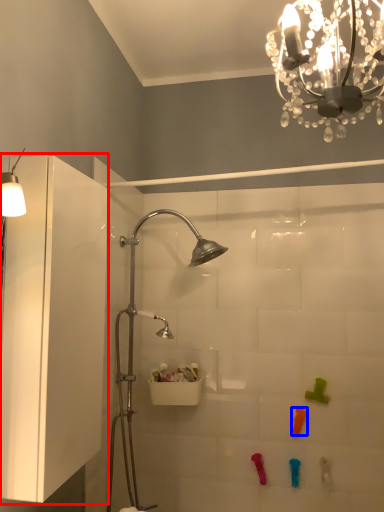
Question: Which object appears closest to the camera in this image, glass door (highlighted by a red box) or toy (highlighted by a blue box)?

Choices:
 (A) glass door
 (B) toy

Answer: (A)